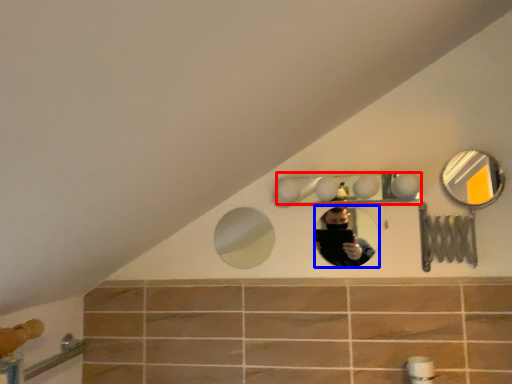
Question: Which object appears farthest to the camera in this image, mirror (highlighted by a red box) or mirror (highlighted by a blue box)?

Choices:
 (A) mirror
 (B) mirror

Answer: (B)